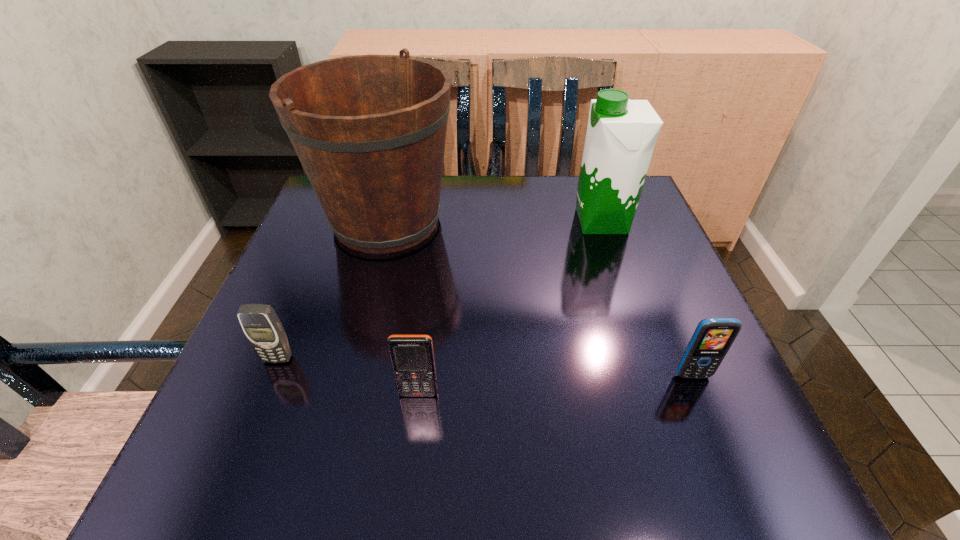
You are a GUI agent. You are given a task and a screenshot of the screen. Output one action in this format:
    pyautogui.click(x=<x>, y=<y>)
    Task: Click on the cellular telephone at the right edge
    
    Given the screenshot: What is the action you would take?
    pyautogui.click(x=713, y=337)

Image resolution: width=960 pixels, height=540 pixels. Find the location of `object at the far left corner`. object at the far left corner is located at coordinates (369, 130).

This screenshot has width=960, height=540. I want to click on object that is at the far right corner, so click(x=621, y=135).

In the image, there is a desktop. Where is `vacant space at the far edge`? The image size is (960, 540). vacant space at the far edge is located at coordinates (558, 176).

The height and width of the screenshot is (540, 960). What are the coordinates of `vacant space at the near edge` in the screenshot? It's located at (632, 487).

Identify the location of vacant point at the left edge. Image resolution: width=960 pixels, height=540 pixels. (305, 334).

In the image, there is a desktop. In order to click on vacant space at the right edge in this screenshot , I will do `click(631, 233)`.

The image size is (960, 540). I want to click on vacant space at the near right corner of the desktop, so click(724, 477).

The height and width of the screenshot is (540, 960). Identify the location of vacant space in between the rightmost cellular telephone and the bucket. (540, 298).

Where is `free space between the second cellular telephone from left to right and the rightmost cellular telephone`? free space between the second cellular telephone from left to right and the rightmost cellular telephone is located at coordinates (556, 384).